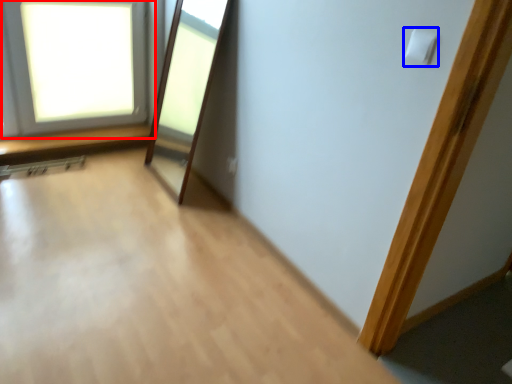
Question: Which point is further to the camera, window (highlighted by a red box) or light switch (highlighted by a blue box)?

Choices:
 (A) window
 (B) light switch

Answer: (A)